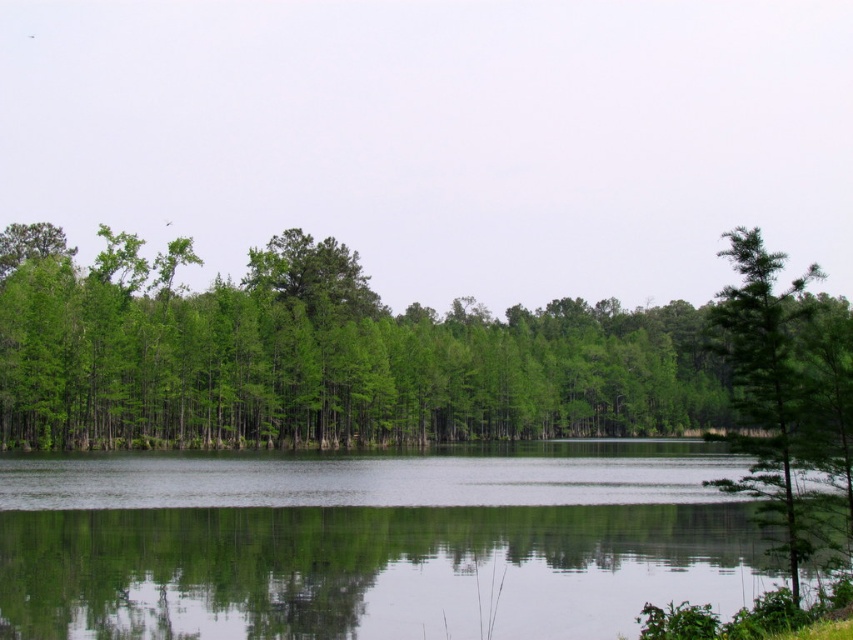
Is point (271, 586) positioned before point (746, 253)?

No, (271, 586) is behind (746, 253).

Can you confirm if transparent water at center is smaller than green leafy tree at right?

Correct, transparent water at center occupies less space than green leafy tree at right.

You are a GUI agent. You are given a task and a screenshot of the screen. Output one action in this format:
    pyautogui.click(x=<x>, y=<y>)
    Task: Click on the transparent water at center
    The height and width of the screenshot is (640, 853).
    Given the screenshot: What is the action you would take?
    pyautogui.click(x=372, y=544)

Is point (281, 390) positioned behind point (746, 256)?

That is True.

Consider the image. Is green matte trees at center closer to the viewer compared to green leafy tree at right?

No.

Is point (625, 413) in front of point (782, 465)?

That is False.

Image resolution: width=853 pixels, height=640 pixels. Find the location of `green matte trees at center`. green matte trees at center is located at coordinates (322, 358).

Does transparent water at center appear over green matte trees at center?

Actually, transparent water at center is below green matte trees at center.

Is transparent water at center bigger than green matte trees at center?

No, transparent water at center is not bigger than green matte trees at center.

This screenshot has width=853, height=640. I want to click on transparent water at center, so click(x=372, y=544).